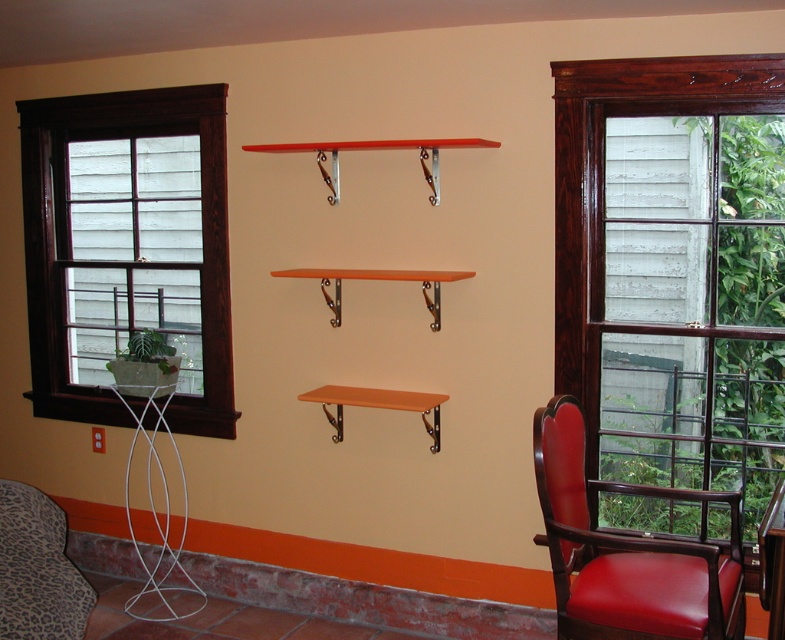
You are trying to decide whether to place a new painting that is the same width as the leather armchair at right on the wall above the brown wood window at left. Based on the scene description, will the painting fit horizontally above the window?

The brown wood window at left is wider than the leather armchair at right. Since the painting has the same width as the leather armchair at right, it will fit horizontally above the brown wood window at left because the window is wider and can accommodate the painting.

You are standing in the room and want to place a small potted plant on the closest object between the wooden frame window at right and the orange wood shelf at center. Which object should you choose?

The wooden frame window at right is closer to the viewer than the orange wood shelf at center, so you should place the potted plant on the wooden frame window at right.

You are arranging plants in the room. You have a small potted plant that needs to be placed near the wooden frame window at right and orange wood shelf at center. Based on their positions, which object is located to the right of the other?

The wooden frame window at right is positioned on the right side of orange wood shelf at center, so the wooden frame window at right is to the right of the orange wood shelf at center.